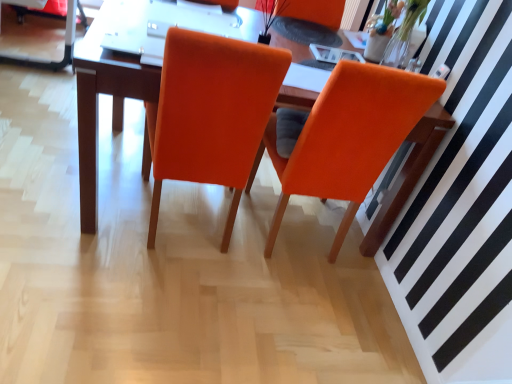
Question: Considering their positions, is orange fabric chair at center, which is the first chair from right to left, located in front of or behind orange fabric armchair at upper center?

Choices:
 (A) behind
 (B) front

Answer: (B)

Question: In terms of height, does orange fabric chair at center, which is the first chair from right to left, look taller or shorter compared to orange fabric armchair at upper center?

Choices:
 (A) short
 (B) tall

Answer: (B)

Question: Which object is the farthest from the orange fabric chair at center, which is the second chair in right-to-left order?

Choices:
 (A) orange fabric armchair at upper center
 (B) orange fabric chair at center, the second chair when ordered from left to right
 (C) matte wood table at center

Answer: (A)

Question: Estimate the real-world distances between objects in this image. Which object is closer to the orange fabric armchair at upper center?

Choices:
 (A) orange fabric chair at center, the second chair when ordered from left to right
 (B) orange fabric chair at center, which is the second chair in right-to-left order
 (C) matte wood table at center

Answer: (A)